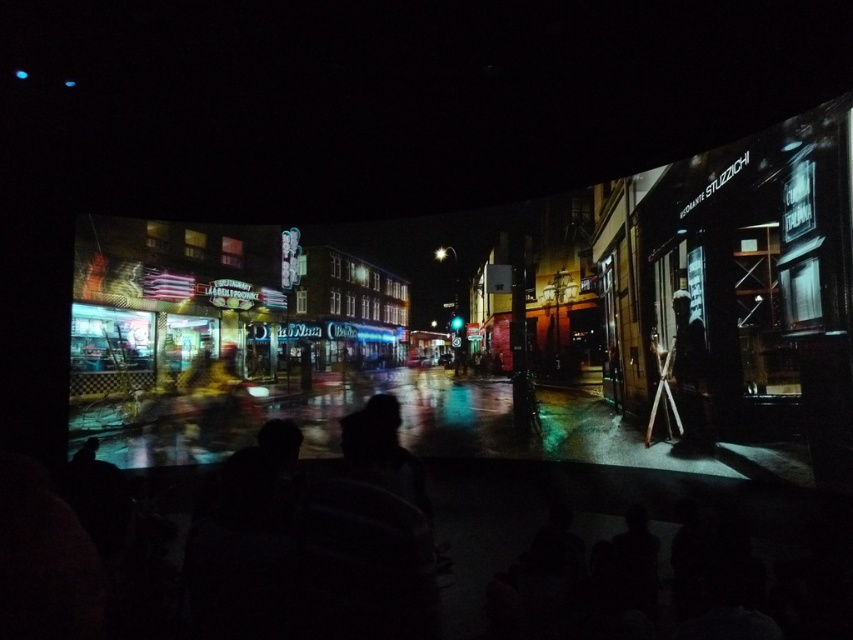
Does black matte crowd at center appear under dark textured figure at right?

Indeed, black matte crowd at center is positioned under dark textured figure at right.

Can you confirm if black matte crowd at center is positioned to the left of dark textured figure at right?

Yes, black matte crowd at center is to the left of dark textured figure at right.

Where is `black matte crowd at center`? This screenshot has width=853, height=640. black matte crowd at center is located at coordinates (479, 550).